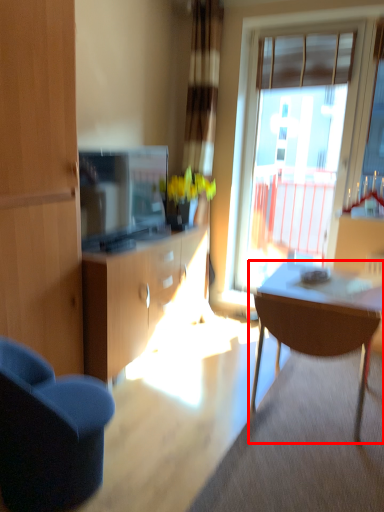
Question: From the image's perspective, what is the correct spatial positioning of kitchen & dining room table (annotated by the red box) in reference to window?

Choices:
 (A) above
 (B) below

Answer: (B)